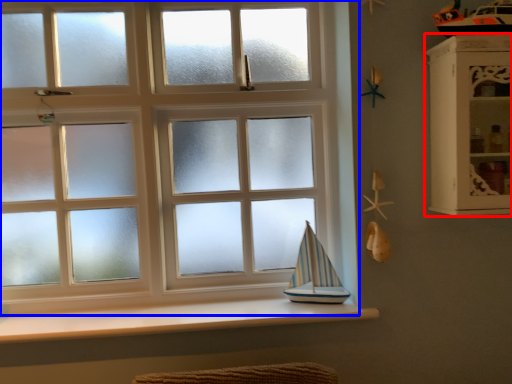
Question: Which object is further to the camera taking this photo, shelf (highlighted by a red box) or window (highlighted by a blue box)?

Choices:
 (A) shelf
 (B) window

Answer: (B)